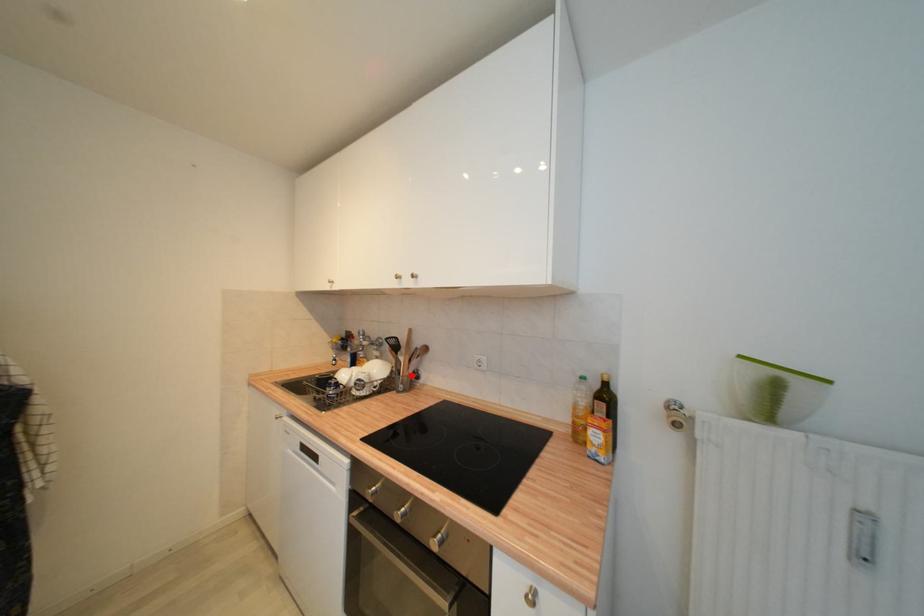
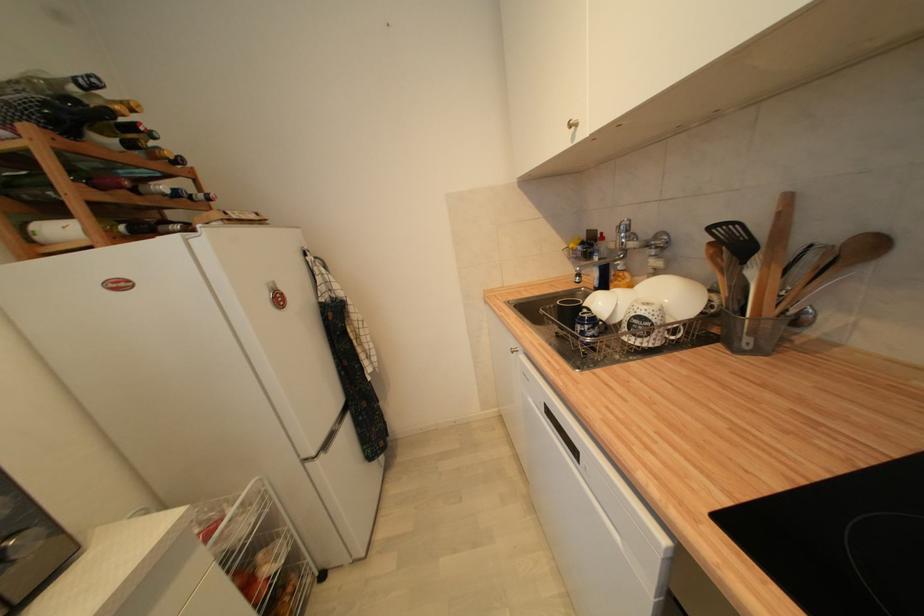
Question: I am providing you with two images of the same scene from different viewpoints. A red point is marked on the first image. At the location where the point appears in image 1, is it still visible in image 2?

Choices:
 (A) Yes
 (B) No

Answer: (A)